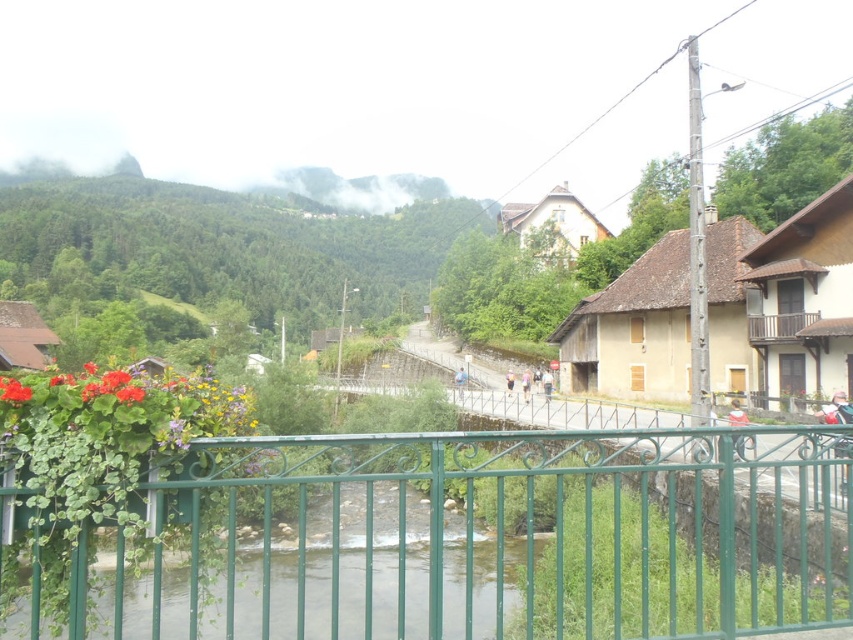
Can you confirm if wooden house at center right is thinner than matte floral arrangement at left?

No.

Is wooden house at center right below matte floral arrangement at left?

Incorrect, wooden house at center right is not positioned below matte floral arrangement at left.

Measure the distance between wooden house at center right and camera.

A distance of 85.34 feet exists between wooden house at center right and camera.

Identify the location of wooden house at center right. The height and width of the screenshot is (640, 853). (782, 298).

Can you confirm if wooden house at center right is wider than brown wooden balcony at upper right?

Indeed, wooden house at center right has a greater width compared to brown wooden balcony at upper right.

Between point (602, 314) and point (805, 320), which one is positioned in front?

Point (805, 320) is more forward.

What do you see at coordinates (782, 298) in the screenshot?
I see `wooden house at center right` at bounding box center [782, 298].

The image size is (853, 640). Identify the location of wooden house at center right. (782, 298).

Does green wrought iron fence at center lie behind brown wooden balcony at upper right?

No.

The width and height of the screenshot is (853, 640). Identify the location of green wrought iron fence at center. (456, 540).